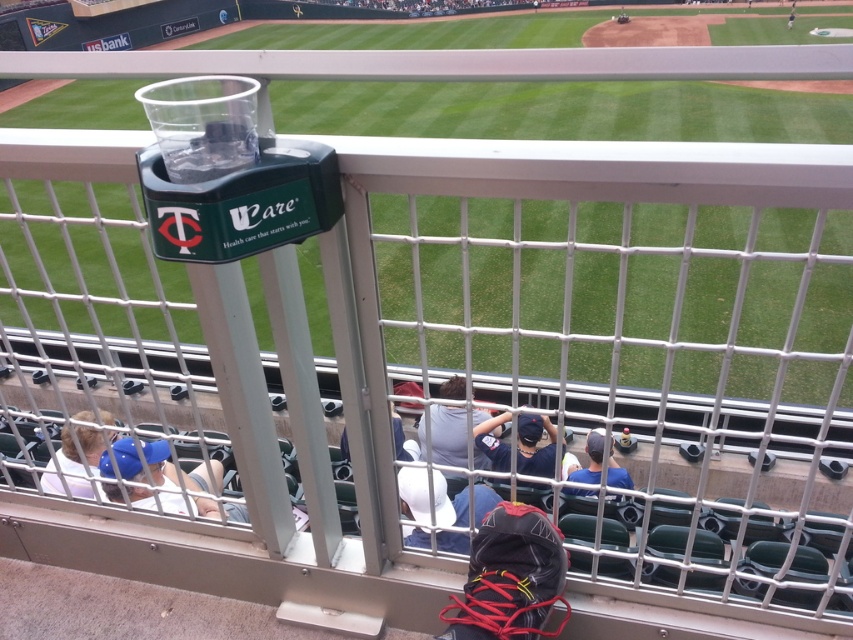
Question: Which object is farther from the camera taking this photo?

Choices:
 (A) white fabric cap at lower left
 (B) black fabric backpack at lower center

Answer: (A)

Question: Can you confirm if blue fabric cap at lower left is smaller than white fabric cap at lower left?

Choices:
 (A) no
 (B) yes

Answer: (A)

Question: Does dark blue baseball cap at center appear under matte gray shirt at center?

Choices:
 (A) no
 (B) yes

Answer: (B)

Question: Which of the following is the farthest from the observer?

Choices:
 (A) (117, 464)
 (B) (112, 419)

Answer: (B)

Question: Considering the relative positions of white matte baseball cap at center and white fabric cap at lower left in the image provided, where is white matte baseball cap at center located with respect to white fabric cap at lower left?

Choices:
 (A) right
 (B) left

Answer: (A)

Question: Which object appears closest to the camera in this image?

Choices:
 (A) blue fabric cap at lower left
 (B) dark blue baseball cap at center
 (C) black fabric backpack at lower center

Answer: (C)